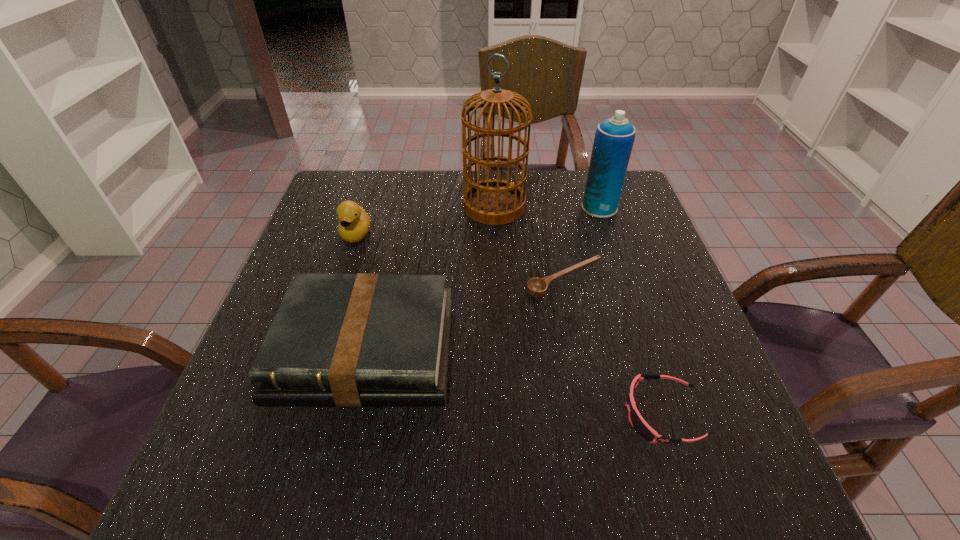
At what (x,y) coordinates should I click in order to perform the action: click on the tallest object. Please return your answer as a coordinate pair (x, y). Looking at the image, I should click on (494, 202).

You are a GUI agent. You are given a task and a screenshot of the screen. Output one action in this format:
    pyautogui.click(x=<x>, y=<y>)
    Task: Click on the aerosol can
    
    Given the screenshot: What is the action you would take?
    pyautogui.click(x=614, y=137)

The image size is (960, 540). In order to click on duckling in this screenshot , I will do `click(354, 223)`.

This screenshot has width=960, height=540. I want to click on hardback book, so click(x=348, y=340).

Locate an element on the screen. The image size is (960, 540). the second shortest object is located at coordinates (638, 423).

Locate an element on the screen. the shortest object is located at coordinates (537, 287).

Find the location of a particular element. The height and width of the screenshot is (540, 960). the third nearest object is located at coordinates (537, 287).

Find the location of a particular element. free space located on the left of the birdcage is located at coordinates (420, 206).

The image size is (960, 540). I want to click on free space located on the left of the fifth shortest object, so click(560, 207).

Locate an element on the screen. The height and width of the screenshot is (540, 960). vacant region located on the face of the duckling is located at coordinates point(316,358).